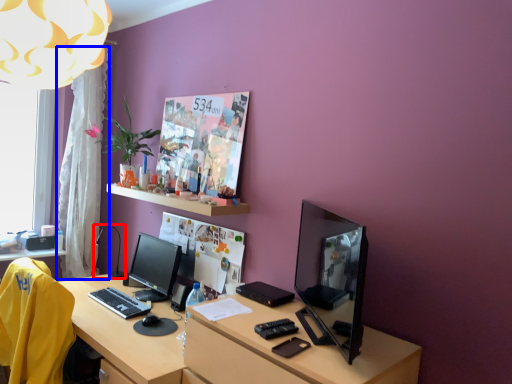
Question: Which of the following is the farthest to the observer, table lamp (highlighted by a red box) or curtain (highlighted by a blue box)?

Choices:
 (A) table lamp
 (B) curtain

Answer: (B)